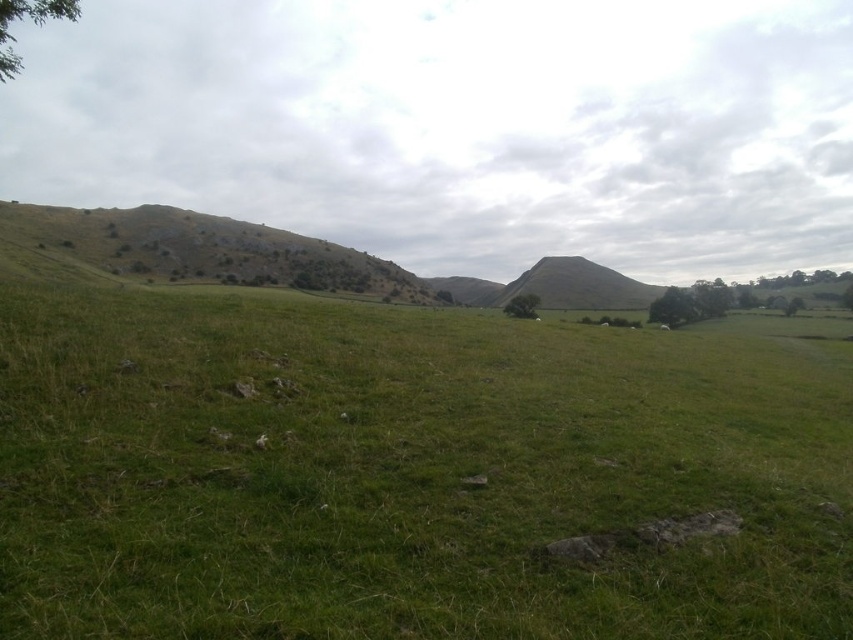
Measure the distance from green grassy hillside at left to green leafy tree at right.

green grassy hillside at left is 153.77 meters from green leafy tree at right.

Locate an element on the screen. The image size is (853, 640). green grassy hillside at left is located at coordinates (193, 250).

Is green grassy field at center smaller than green grassy hillside at center?

Correct, green grassy field at center occupies less space than green grassy hillside at center.

Identify the location of green grassy field at center. The width and height of the screenshot is (853, 640). (409, 472).

Between green grassy hillside at left and green leafy tree at upper left, which one has more height?

Standing taller between the two is green leafy tree at upper left.

Is green grassy hillside at left smaller than green leafy tree at upper left?

Incorrect, green grassy hillside at left is not smaller in size than green leafy tree at upper left.

The height and width of the screenshot is (640, 853). What do you see at coordinates (193, 250) in the screenshot?
I see `green grassy hillside at left` at bounding box center [193, 250].

Find the location of a particular element. The height and width of the screenshot is (640, 853). green grassy hillside at left is located at coordinates (193, 250).